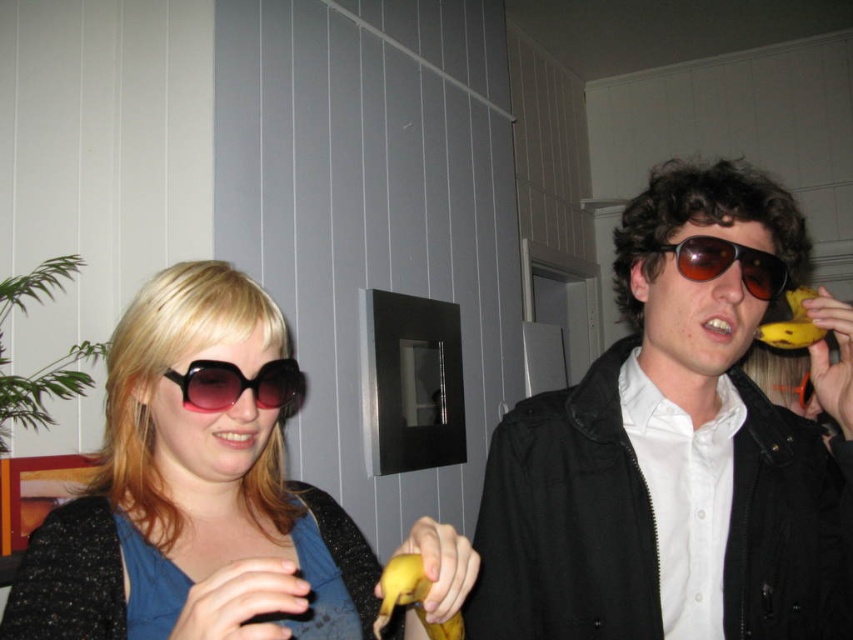
The image size is (853, 640). Describe the element at coordinates (184, 486) in the screenshot. I see `matte black sunglasses at left` at that location.

Does point (97, 512) come closer to viewer compared to point (744, 262)?

That is True.

Locate an element on the screen. The image size is (853, 640). matte black sunglasses at left is located at coordinates (184, 486).

Which is behind, point (834, 316) or point (393, 564)?

The point (834, 316) is behind.

Is matte black jacket at right to the left of yellow matte banana at lower center from the viewer's perspective?

Incorrect, matte black jacket at right is not on the left side of yellow matte banana at lower center.

Find the location of `matte black jacket at right`. matte black jacket at right is located at coordinates (675, 442).

This screenshot has width=853, height=640. In order to click on matte black jacket at right in this screenshot , I will do `click(675, 442)`.

Between yellow matte banana at lower center and yellow matte banana at right, which one has less height?

With less height is yellow matte banana at right.

Who is higher up, yellow matte banana at lower center or yellow matte banana at right?

yellow matte banana at right

Between point (451, 627) and point (811, 333), which one is positioned behind?

The point (811, 333) is more distant.

Locate an element on the screen. The height and width of the screenshot is (640, 853). yellow matte banana at lower center is located at coordinates (410, 596).